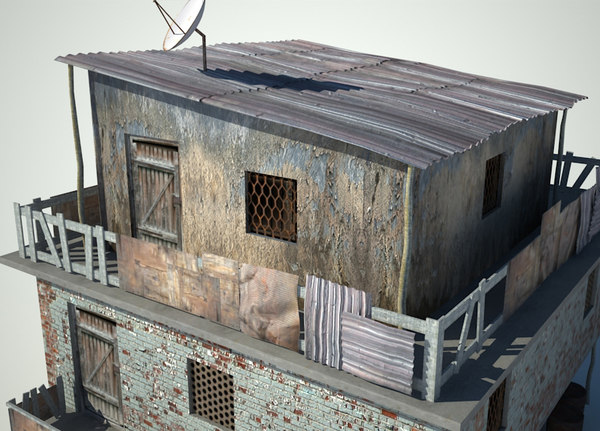
At what (x,y) coordinates should I click in order to perform the action: click on window. Please return your answer as a coordinate pair (x, y). The height and width of the screenshot is (431, 600). Looking at the image, I should click on (233, 400).